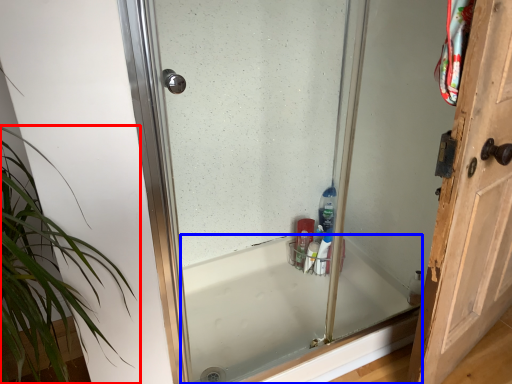
Question: Which object appears farthest to the camera in this image, houseplant (highlighted by a red box) or bathtub (highlighted by a blue box)?

Choices:
 (A) houseplant
 (B) bathtub

Answer: (B)